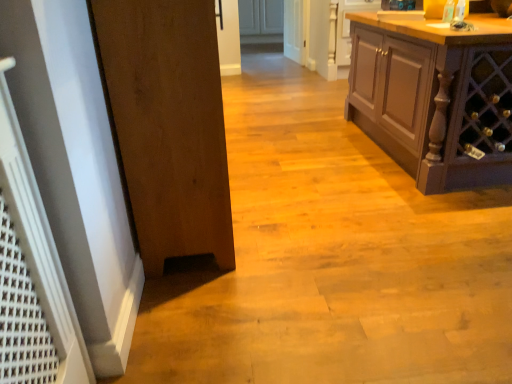
Question: From a real-world perspective, does white glossy door at center stand above matte brown cabinet at right?

Choices:
 (A) no
 (B) yes

Answer: (A)

Question: From a real-world perspective, does white glossy door at center sit lower than matte brown cabinet at right?

Choices:
 (A) yes
 (B) no

Answer: (A)

Question: Is white glossy door at center oriented towards matte brown cabinet at right?

Choices:
 (A) yes
 (B) no

Answer: (B)

Question: Considering the relative sizes of white glossy door at center and matte brown cabinet at right in the image provided, is white glossy door at center shorter than matte brown cabinet at right?

Choices:
 (A) no
 (B) yes

Answer: (B)

Question: Is white glossy door at center at the left side of matte brown cabinet at right?

Choices:
 (A) no
 (B) yes

Answer: (B)

Question: Is white glossy door at center bigger than matte brown cabinet at right?

Choices:
 (A) yes
 (B) no

Answer: (B)

Question: From a real-world perspective, does wooden door at left sit lower than white glossy door at center?

Choices:
 (A) yes
 (B) no

Answer: (B)

Question: Would you say wooden door at left contains white glossy door at center?

Choices:
 (A) no
 (B) yes

Answer: (A)

Question: Considering the relative sizes of wooden door at left and white glossy door at center in the image provided, is wooden door at left wider than white glossy door at center?

Choices:
 (A) yes
 (B) no

Answer: (A)

Question: Is white glossy door at center at the back of wooden door at left?

Choices:
 (A) no
 (B) yes

Answer: (A)

Question: From the image's perspective, is wooden door at left under white glossy door at center?

Choices:
 (A) yes
 (B) no

Answer: (A)

Question: Is wooden door at left next to white glossy door at center and touching it?

Choices:
 (A) no
 (B) yes

Answer: (A)

Question: From a real-world perspective, does wooden door at left stand above matte brown cabinet at right?

Choices:
 (A) yes
 (B) no

Answer: (A)